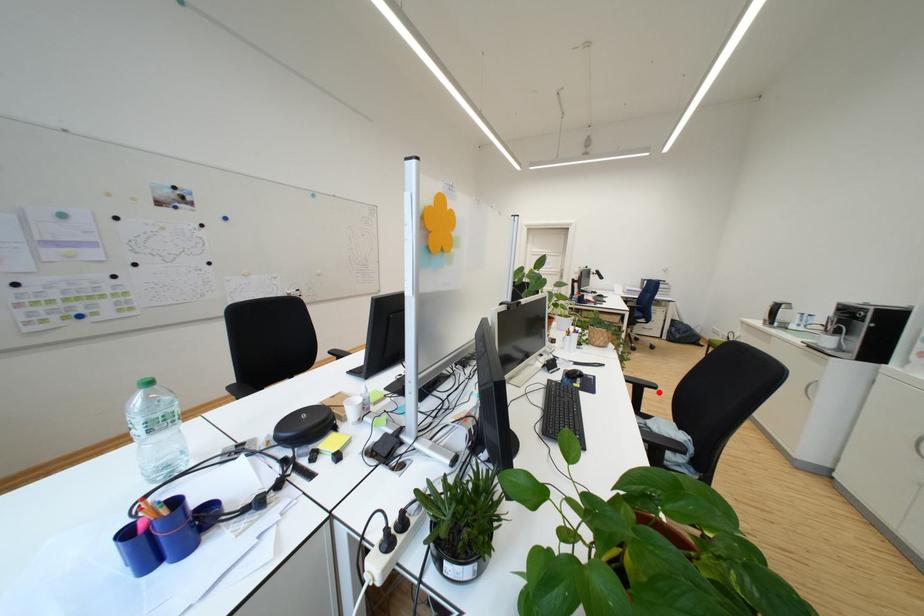
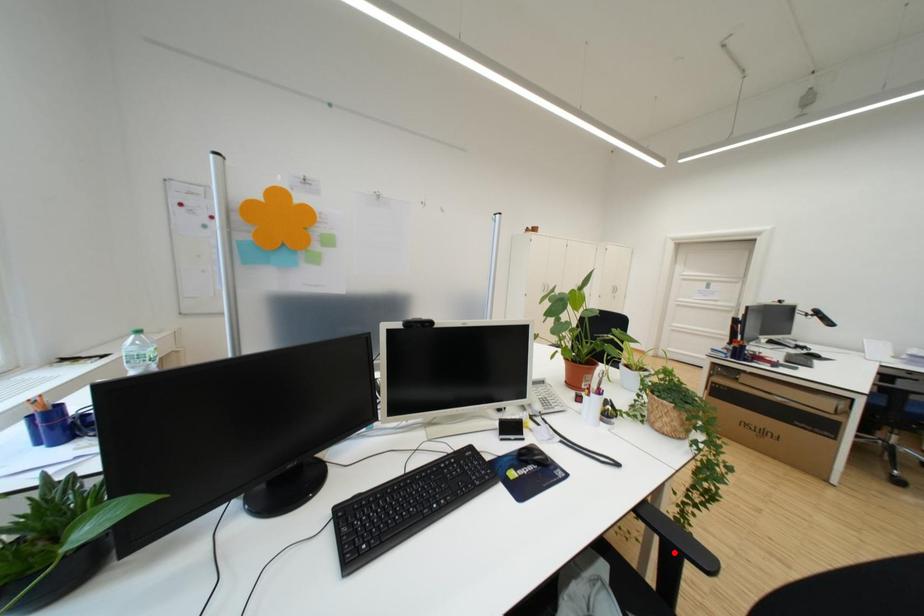
I am providing you with two images of the same scene from different viewpoints. A red point is marked on the first image and another point is marked on the second image. Are the points marked in image1 and image2 representing the same 3D position?

No